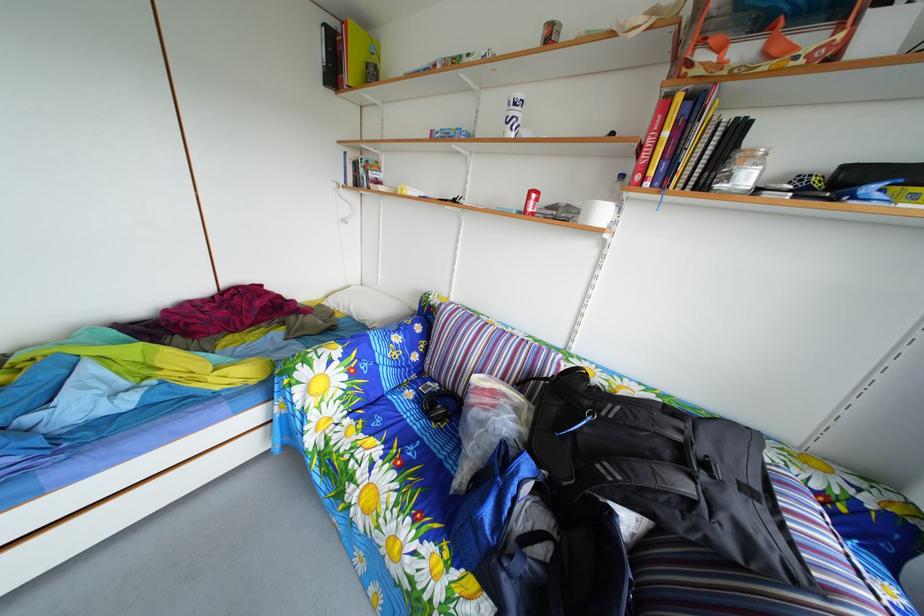
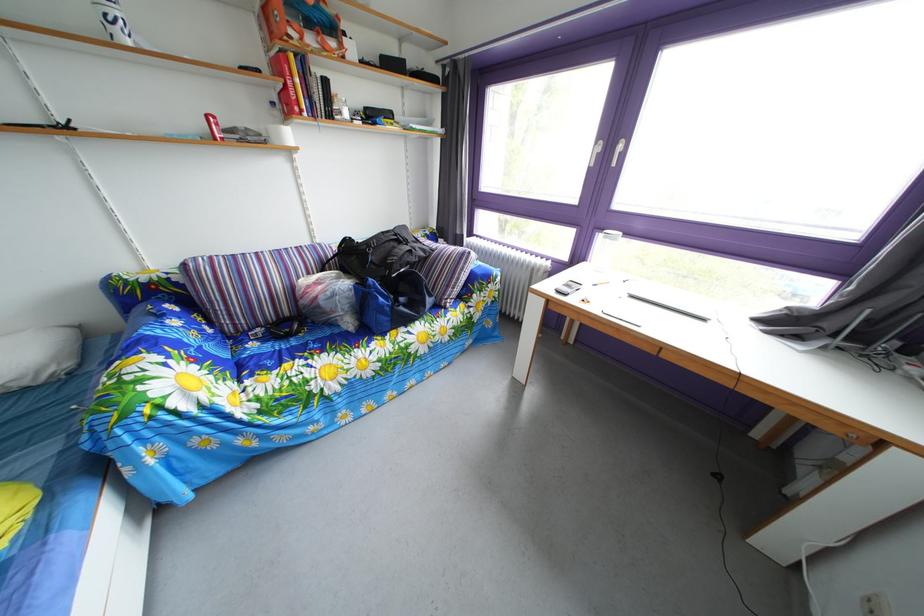
Where in the second image is the point corresponding to pixel 420 402 from the first image?

(262, 353)